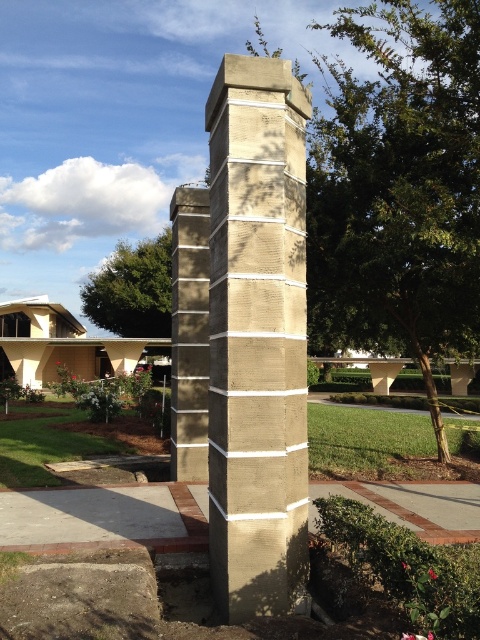
In the scene shown: You are standing at point (256,337) in the image. What object is located exactly at your position?

The concrete textured column at center is located exactly at point (256,337).

You are a landscape architect reviewing the site plan. You need to place a new decorative statue between the concrete textured column at center and the gray concrete at lower left. Which object should the statue be placed closer to, based on their positions?

The statue should be placed closer to the gray concrete at lower left because the concrete textured column at center is closer to the viewer than the gray concrete at lower left, meaning the gray concrete is further back, allowing space between them for the statue placement.

You are standing in front of the sandy concrete column at center. You want to take a photo of it with your smartphone. The camera app shows that the minimum focus distance is 0.5 meters. Will the column be in focus if you take the photo from where you are standing?

The sandy concrete column at center is 7.75 meters away from the camera. Since 7.75 meters is greater than the minimum focus distance of 0.5 meters, the column will be in focus when you take the photo from that distance.